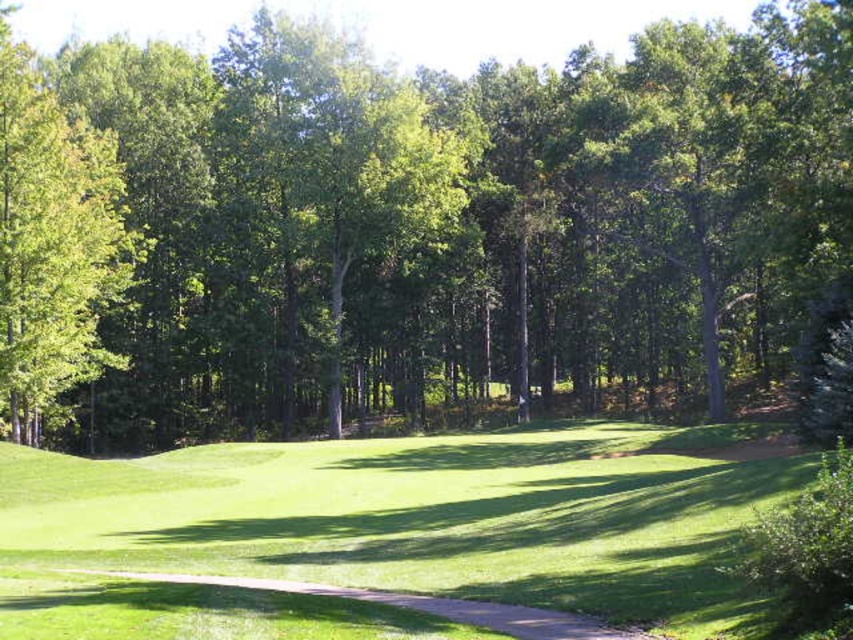
Question: Which of the following is the closest to the observer?

Choices:
 (A) green leafy tree at left
 (B) brown gravel path at center
 (C) green leafy tree at center
 (D) green grassy golf course at center

Answer: (D)

Question: Does green leafy tree at center have a lesser width compared to brown gravel path at center?

Choices:
 (A) no
 (B) yes

Answer: (A)

Question: Which object is the closest to the green grassy golf course at center?

Choices:
 (A) green leafy tree at center
 (B) brown gravel path at center

Answer: (B)

Question: Which of the following is the farthest from the observer?

Choices:
 (A) (647, 484)
 (B) (22, 134)
 (C) (548, 632)
 (D) (248, 28)

Answer: (D)

Question: Is the position of green grassy golf course at center less distant than that of green leafy tree at left?

Choices:
 (A) no
 (B) yes

Answer: (B)

Question: Is green leafy tree at center bigger than brown gravel path at center?

Choices:
 (A) yes
 (B) no

Answer: (A)